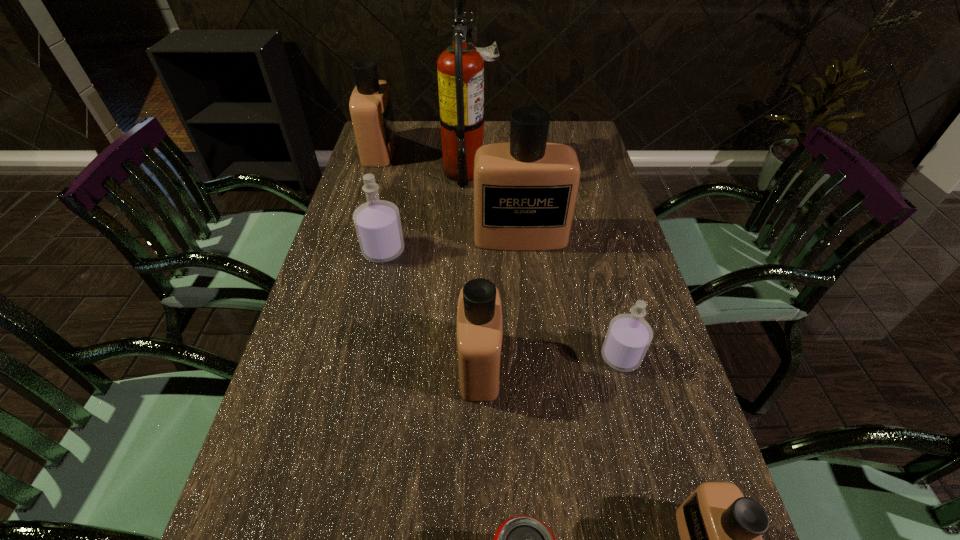
Where is `the smaller purple perfume`? the smaller purple perfume is located at coordinates (628, 337).

Find the location of a particular element. Image resolution: width=960 pixels, height=540 pixels. free region located from the nozzle of the red fire extinguisher is located at coordinates (516, 171).

At what (x,y) coordinates should I click in order to perform the action: click on vacant region located on the front label of the third nearest beige perfume. Please return your answer as a coordinate pair (x, y). Looking at the image, I should click on click(x=535, y=381).

This screenshot has height=540, width=960. Identify the location of free space located 0.100m on the front label of the third tallest object. (422, 151).

Find the location of a particular element. This screenshot has width=960, height=540. vacant region located 0.130m on the back of the left purple perfume is located at coordinates (393, 209).

Where is `vacant region located on the front label of the second nearest beige perfume`? vacant region located on the front label of the second nearest beige perfume is located at coordinates (523, 365).

Locate an element on the screen. This screenshot has width=960, height=540. vacant region located on the back of the nearer purple perfume is located at coordinates (598, 269).

You are a GUI agent. You are given a task and a screenshot of the screen. Output one action in this format:
    pyautogui.click(x=<x>, y=<y>)
    Task: Click on the fire extinguisher located in the far edge section of the desktop
    
    Given the screenshot: What is the action you would take?
    pyautogui.click(x=460, y=68)

Where is `perfume at the far edge`? This screenshot has height=540, width=960. perfume at the far edge is located at coordinates (370, 106).

Where is `object at the right edge`? Image resolution: width=960 pixels, height=540 pixels. object at the right edge is located at coordinates (628, 337).